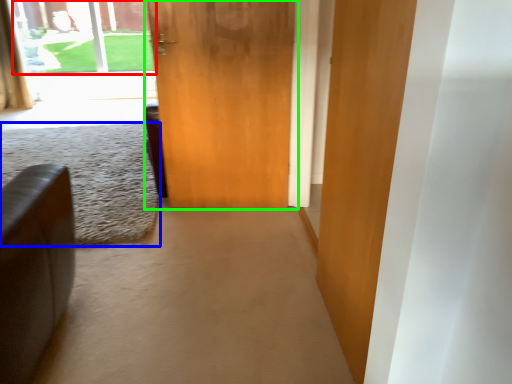
Question: Considering the real-world distances, which object is closest to window screen (highlighted by a red box)? plain (highlighted by a blue box) or door (highlighted by a green box).

Choices:
 (A) plain
 (B) door

Answer: (A)